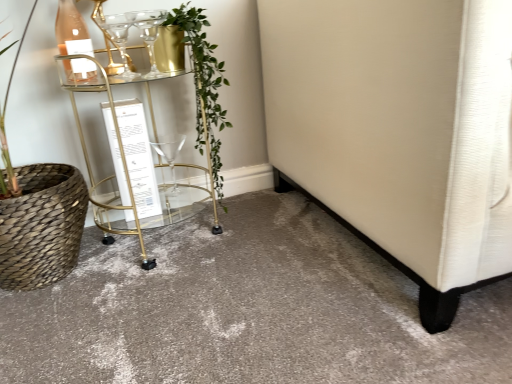
At what (x,y) coordinates should I click in order to perform the action: click on free spot in front of gold metallic bar cart at center. Please return your answer as a coordinate pair (x, y). Image resolution: width=512 pixels, height=384 pixels. Looking at the image, I should click on (143, 294).